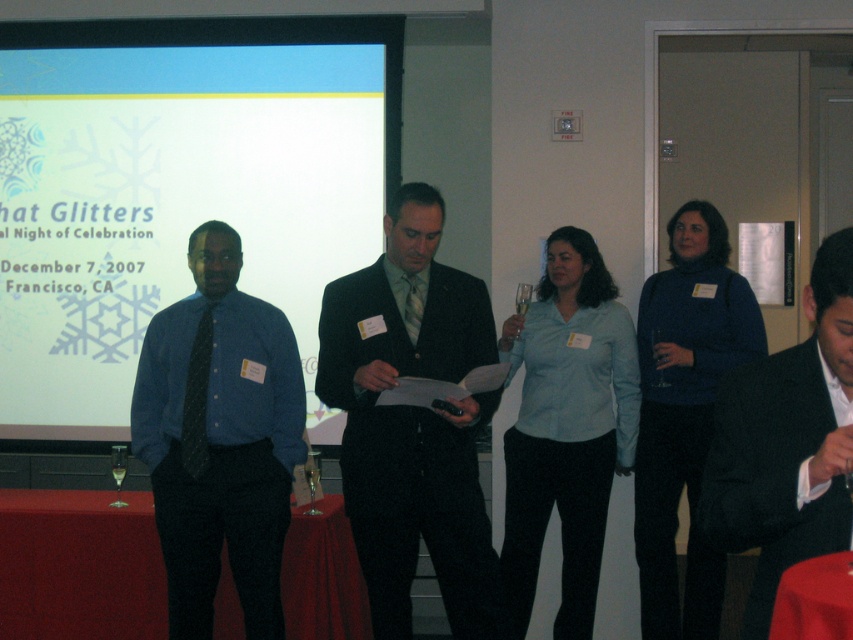
You are a photographer positioned at the back of the room. You need to capture a photo of both the dark suit at center and the smooth red tablecloth at lower right. However, you can only focus on one object at a time. Which object should you focus on first to ensure it appears clearer in the photo?

The dark suit at center is closer to you than the smooth red tablecloth at lower right, so focusing on the dark suit at center first will ensure it appears clearer in the photo.

In the scene described, there is a light blue shirt at center and a smooth red tablecloth at lower right. Which object is higher in height?

The light blue shirt at center is taller than the smooth red tablecloth at lower right.